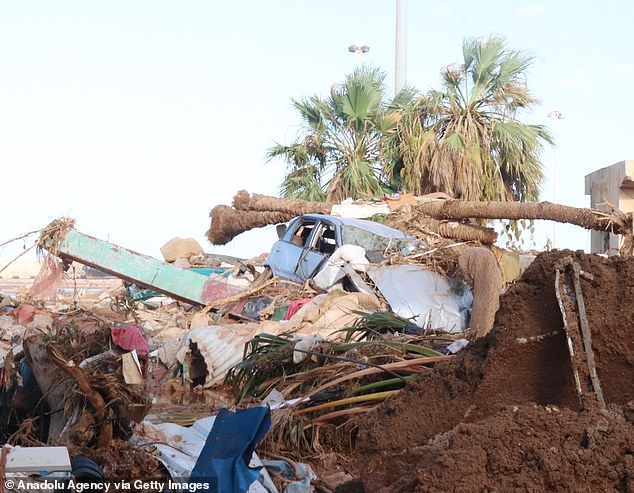
Find the location of a particular element. Image resolution: width=634 pixels, height=493 pixels. lights is located at coordinates (359, 49).